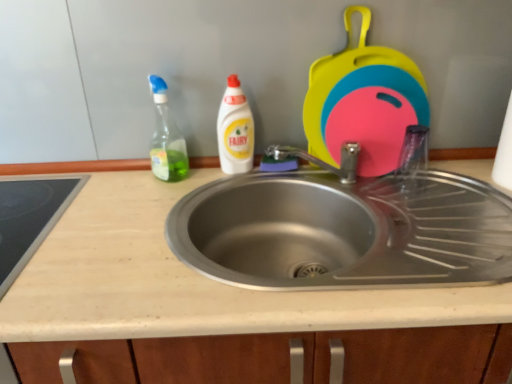
Identify the location of vacant space to the right of translucent plastic spray bottle at left, the second cleaning product from the right. This screenshot has width=512, height=384. (216, 178).